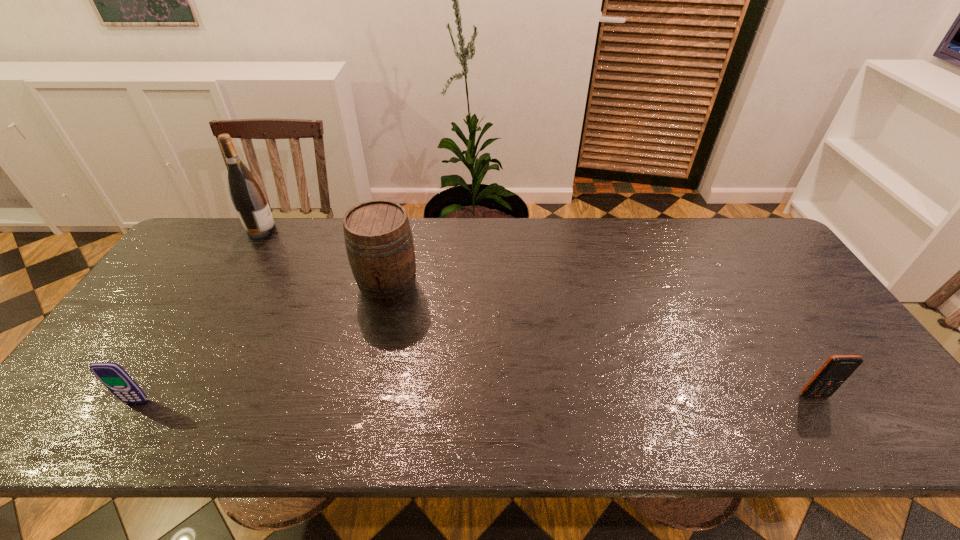
Find the location of a particular element. The height and width of the screenshot is (540, 960). free space located on the screen of the farther cellular telephone is located at coordinates point(831,423).

Locate an element on the screen. free space located on the front-facing side of the left cellular telephone is located at coordinates (122, 424).

Identify the location of object located in the far edge section of the desktop. The width and height of the screenshot is (960, 540). (249, 200).

The width and height of the screenshot is (960, 540). I want to click on wine bottle located at the left edge, so click(249, 200).

The height and width of the screenshot is (540, 960). In order to click on cellular telephone at the left edge in this screenshot , I will do `click(113, 376)`.

You are a GUI agent. You are given a task and a screenshot of the screen. Output one action in this format:
    pyautogui.click(x=<x>, y=<y>)
    Task: Click on the object that is at the right edge
    
    Given the screenshot: What is the action you would take?
    pyautogui.click(x=836, y=370)

Where is `object situated at the far left corner`? This screenshot has height=540, width=960. object situated at the far left corner is located at coordinates 249,200.

Locate an element on the screen. vacant space at the far edge of the desktop is located at coordinates (298, 248).

In the image, there is a desktop. Where is `vacant space at the near edge`? This screenshot has height=540, width=960. vacant space at the near edge is located at coordinates (336, 441).

At what (x,y) coordinates should I click in order to perform the action: click on free space at the left edge. Please return your answer as a coordinate pair (x, y). The height and width of the screenshot is (540, 960). Looking at the image, I should click on 190,286.